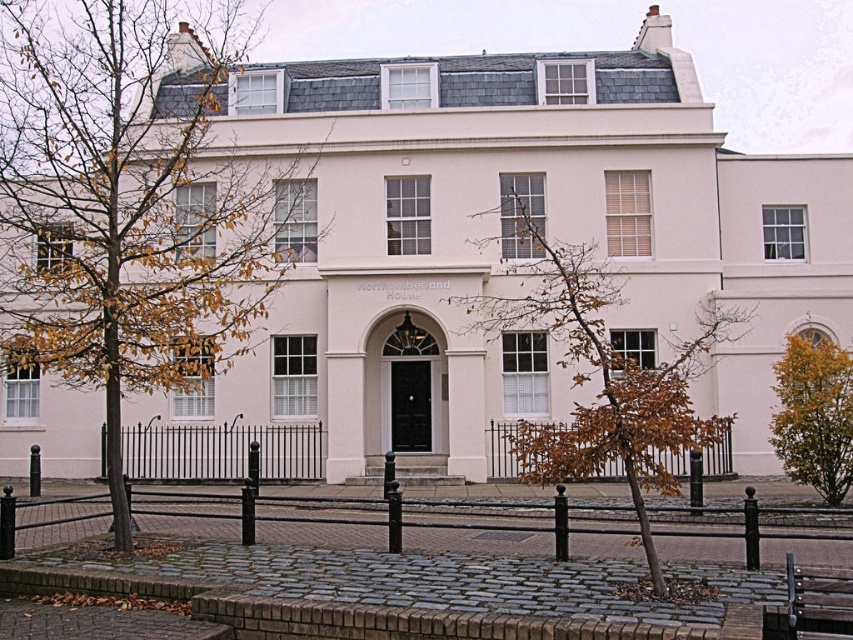
Question: Which point is closer to the camera?

Choices:
 (A) black wrought iron fence at center
 (B) brown leafy tree at left

Answer: (A)

Question: Is yellow-green foliage at right closer to camera compared to metallic silver bench at lower right?

Choices:
 (A) no
 (B) yes

Answer: (A)

Question: Which object appears closest to the camera in this image?

Choices:
 (A) yellow-green foliage at right
 (B) metallic silver bench at lower right
 (C) black wrought iron fence at lower center
 (D) brown leafy tree at left

Answer: (B)

Question: Which object appears farthest from the camera in this image?

Choices:
 (A) brown leafy tree at center
 (B) yellow-green foliage at right
 (C) brown leafy tree at left
 (D) black wrought iron fence at lower center

Answer: (D)

Question: Is brown leafy tree at left positioned behind black wrought iron fence at center?

Choices:
 (A) no
 (B) yes

Answer: (B)

Question: Does brown leafy tree at center appear under black wrought iron fence at lower center?

Choices:
 (A) no
 (B) yes

Answer: (A)